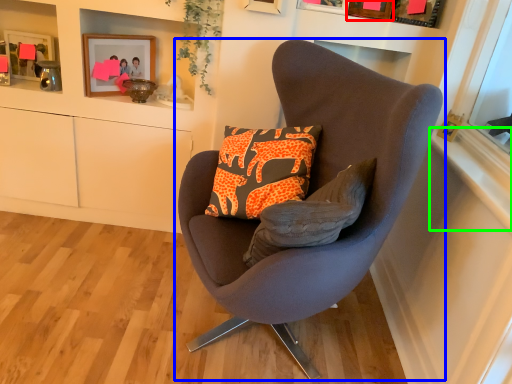
Question: Based on their relative distances, which object is farther from picture frame (highlighted by a red box)? Choose from chair (highlighted by a blue box) and window sill (highlighted by a green box).

Choices:
 (A) chair
 (B) window sill

Answer: (A)